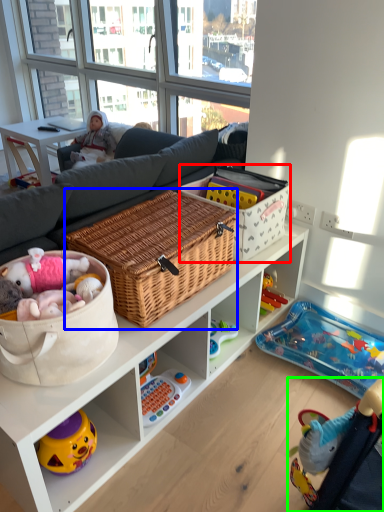
Question: Considering the real-world distances, which object is farthest from storage box (highlighted by a red box)? picnic basket (highlighted by a blue box) or baby carriage (highlighted by a green box)?

Choices:
 (A) picnic basket
 (B) baby carriage

Answer: (B)